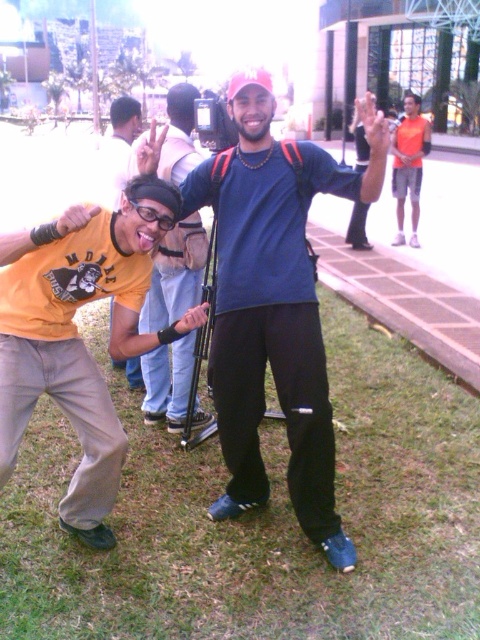
Who is higher up, blue matte shirt at center or yellow matte t-shirt at lower left?

blue matte shirt at center is higher up.

The image size is (480, 640). Describe the element at coordinates (276, 305) in the screenshot. I see `blue matte shirt at center` at that location.

Is point (320, 429) positioned before point (75, 365)?

Yes, it is in front of point (75, 365).

Locate an element on the screen. blue matte shirt at center is located at coordinates (276, 305).

Which is in front, point (164, 392) or point (394, 244)?

Point (164, 392) is more forward.

Can you confirm if matte yellow t-shirt at left is smaller than orange mesh shirt at upper right?

Yes, matte yellow t-shirt at left is smaller than orange mesh shirt at upper right.

Which is behind, point (182, 356) or point (418, 161)?

Point (418, 161)

Identify the location of matte yellow t-shirt at left. This screenshot has width=480, height=640. (176, 275).

Is yellow matte t-shirt at lower left wider than orange mesh shirt at upper right?

In fact, yellow matte t-shirt at lower left might be narrower than orange mesh shirt at upper right.

Consider the image. Can you confirm if yellow matte t-shirt at lower left is taller than orange mesh shirt at upper right?

No.

Is point (151, 262) more distant than point (402, 125)?

That is False.

At what (x,y) coordinates should I click in order to perform the action: click on yellow matte t-shirt at lower left. Please return your answer as a coordinate pair (x, y). Looking at the image, I should click on (79, 336).